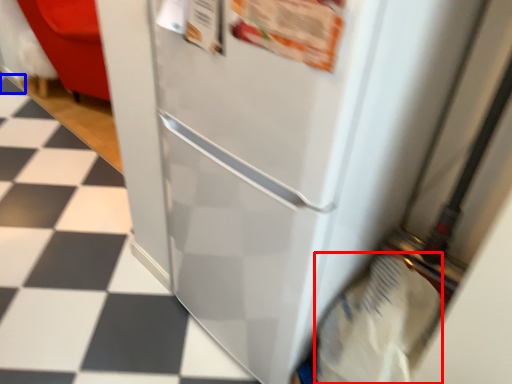
Question: Which of the following is the farthest to the observer, grocery bag (highlighted by a red box) or tile (highlighted by a blue box)?

Choices:
 (A) grocery bag
 (B) tile

Answer: (B)